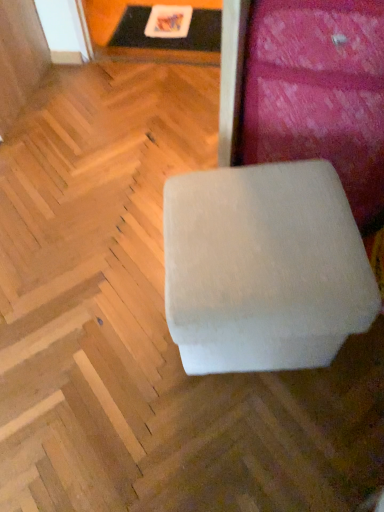
Where is `free spot to the left of white fabric ottoman at center, which appears as the 1th furniture when ordered from the bottom`? free spot to the left of white fabric ottoman at center, which appears as the 1th furniture when ordered from the bottom is located at coordinates (111, 334).